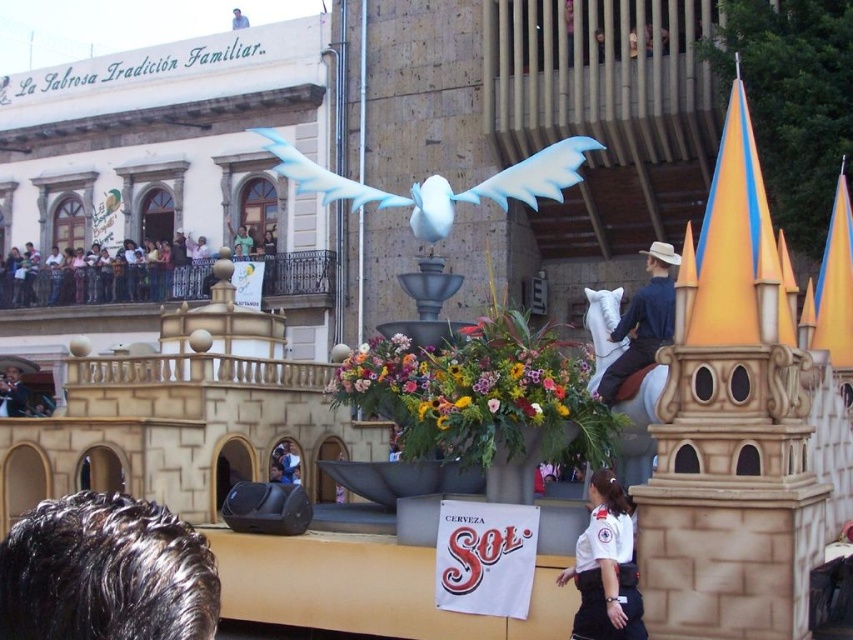
Question: Is white uniform at center above light blue fabric at upper center?

Choices:
 (A) no
 (B) yes

Answer: (A)

Question: Which point is farther to the camera?

Choices:
 (A) dark brown hair at lower left
 (B) smooth skin face at center

Answer: (B)

Question: Observing the image, what is the correct spatial positioning of white uniform at center in reference to light blue fabric at upper center?

Choices:
 (A) left
 (B) right

Answer: (B)

Question: Estimate the real-world distances between objects in this image. Which object is closer to the white matte bird at center?

Choices:
 (A) matte blue shirt at center
 (B) dark brown hair at lower left

Answer: (A)

Question: Can you confirm if white matte bird at center is positioned above white uniform at center?

Choices:
 (A) yes
 (B) no

Answer: (A)

Question: Which is farther from the smooth skin face at center?

Choices:
 (A) light blue fabric at upper center
 (B) smooth brown leather jacket at upper left

Answer: (A)